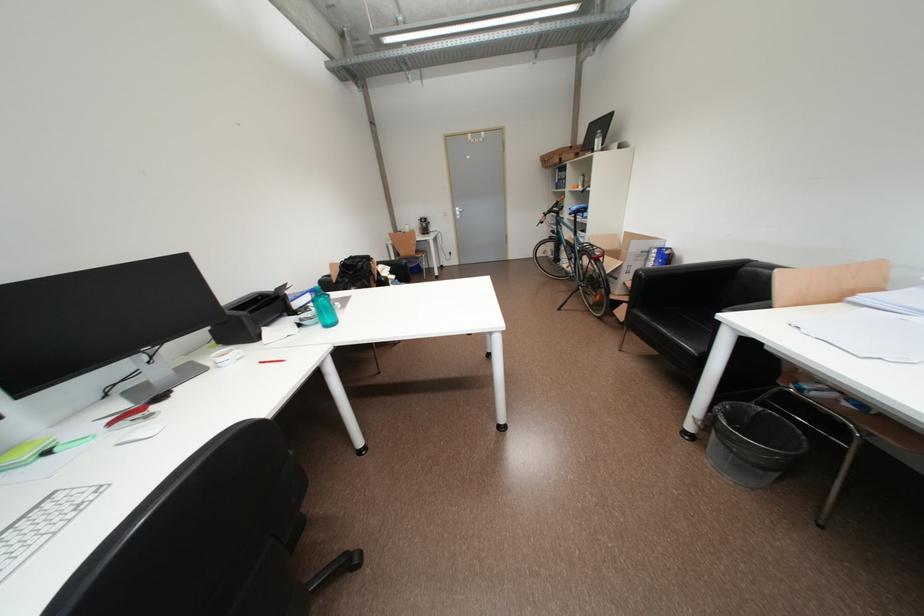
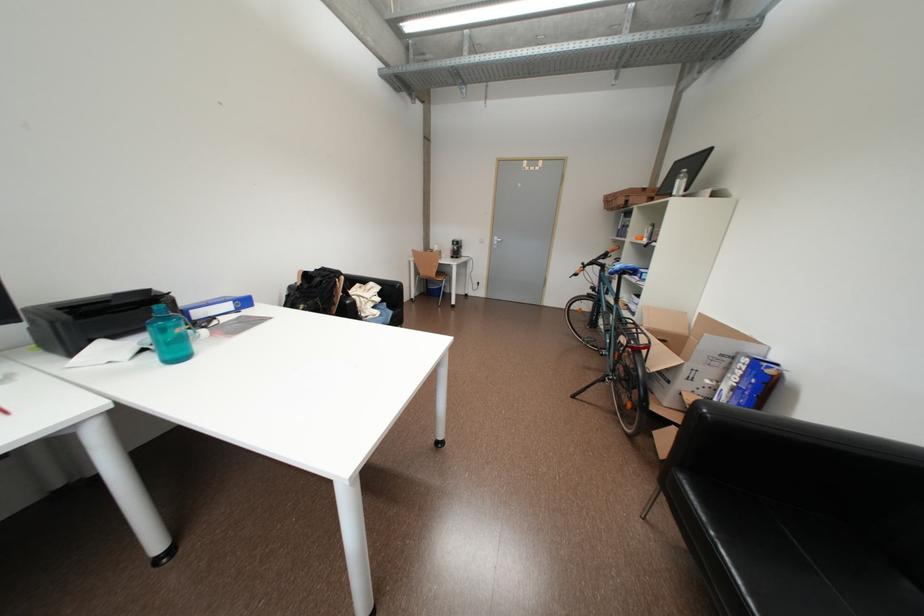
Find the pixel in the second image that matches point 371,268 in the first image.

(330, 284)